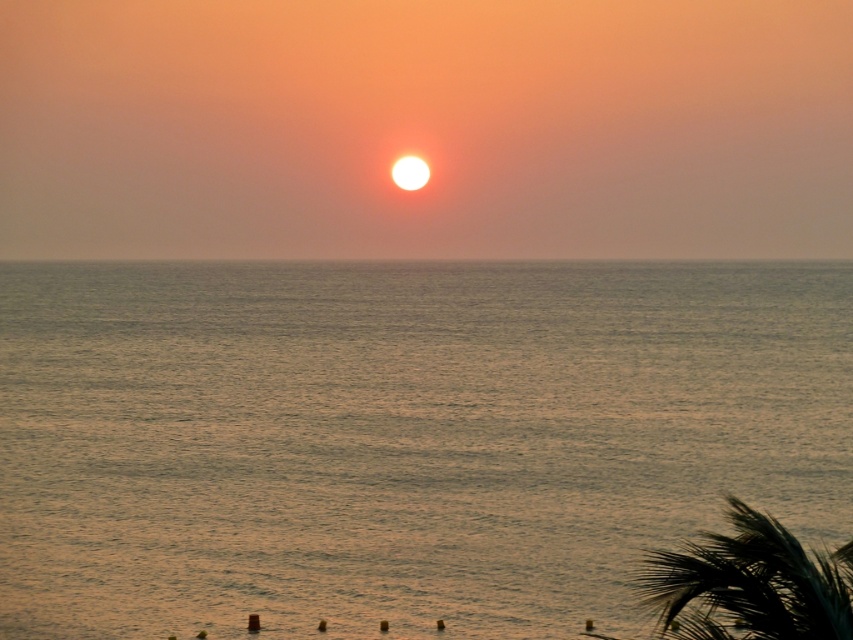
You are standing on a beach and see the silvery water at center and the dark green leafy palm tree at lower right. Which object is higher in the image?

The silvery water at center is higher than the dark green leafy palm tree at lower right because it is positioned above it in the scene.

You are standing on the beach and see the silvery water at center and the dark green leafy palm tree at lower right. Which object is closer to your left side?

The silvery water at center is to the left of the dark green leafy palm tree at lower right, so when standing on the beach facing the water, the silvery water at center would be closer to your left side.